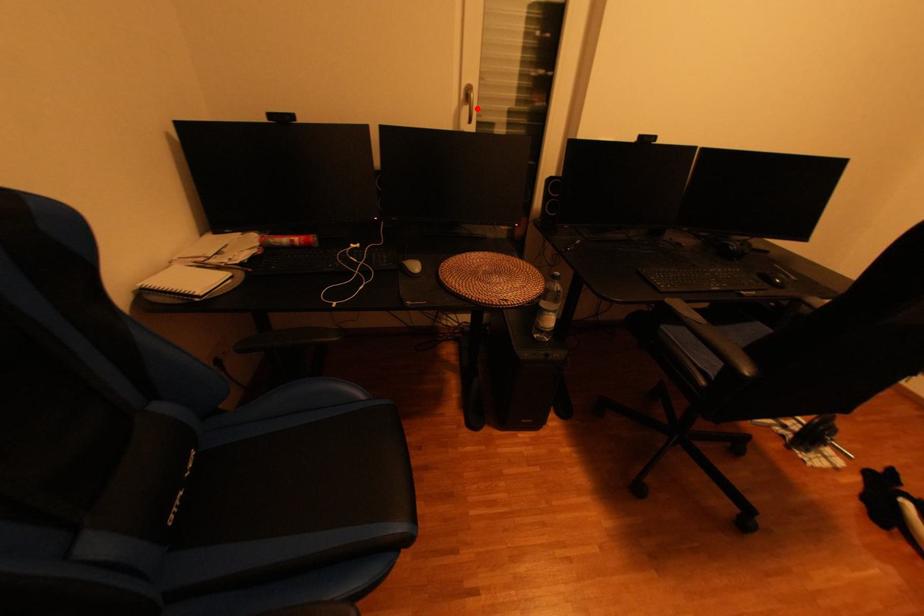
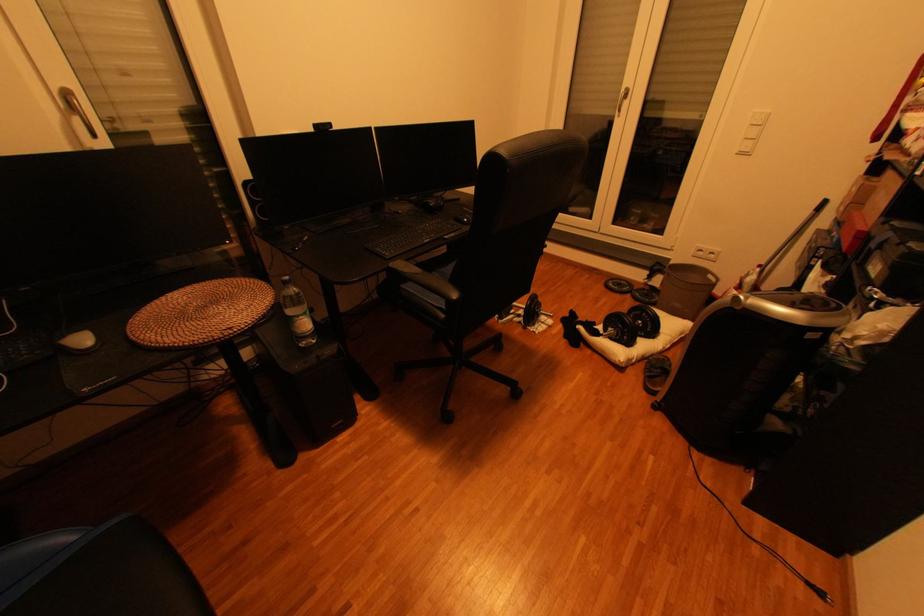
In the second image, find the point that corresponds to the highlighted location in the first image.

(84, 121)